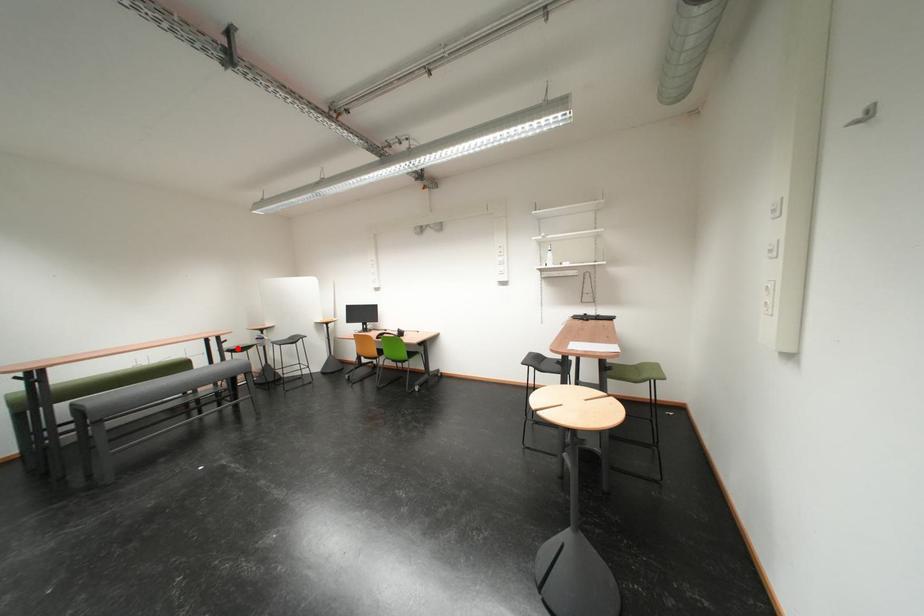
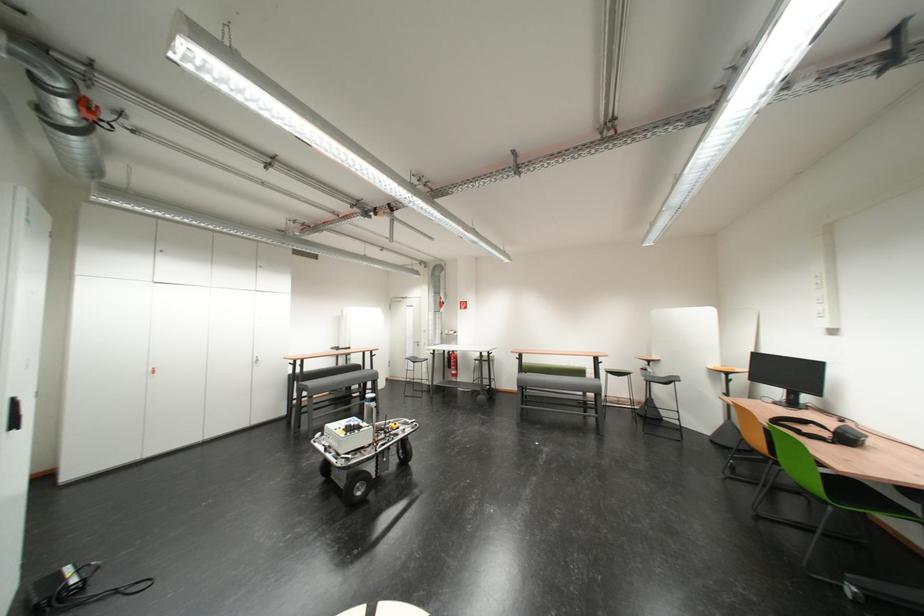
Question: I am providing you with two images of the same scene from different viewpoints. Given a red point in image1, look at the same physical point in image2. Is it:

Choices:
 (A) Closer to the viewpoint
 (B) Farther from the viewpoint

Answer: (B)